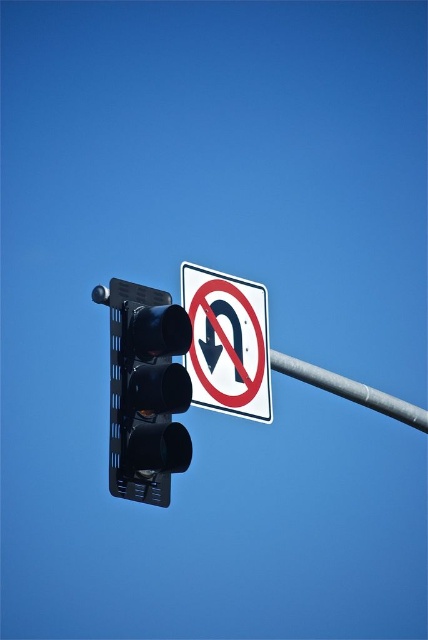
Question: From the image, what is the correct spatial relationship of black matte traffic light at left in relation to white plastic sign at upper center?

Choices:
 (A) left
 (B) right

Answer: (A)

Question: Observing the image, what is the correct spatial positioning of white plastic sign at upper center in reference to metallic gray pole at center?

Choices:
 (A) below
 (B) above

Answer: (B)

Question: Is black matte traffic light at left to the right of metallic gray pole at center from the viewer's perspective?

Choices:
 (A) yes
 (B) no

Answer: (B)

Question: Which of the following is the closest to the observer?

Choices:
 (A) white plastic sign at upper center
 (B) metallic gray pole at center

Answer: (A)

Question: Which point is farther to the camera?

Choices:
 (A) black matte traffic light at left
 (B) metallic gray pole at center

Answer: (B)

Question: Which point appears closest to the camera in this image?

Choices:
 (A) (368, 392)
 (B) (211, 397)

Answer: (B)